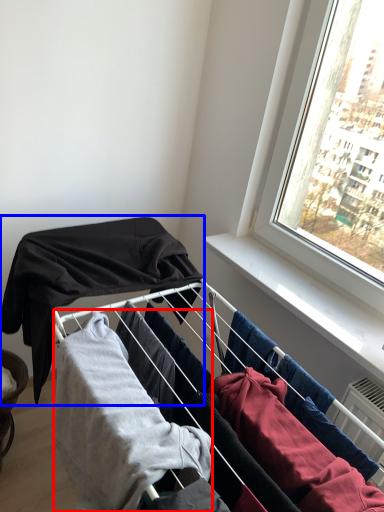
Question: Which object is closer to the camera taking this photo, clothing (highlighted by a red box) or clothing (highlighted by a blue box)?

Choices:
 (A) clothing
 (B) clothing

Answer: (A)